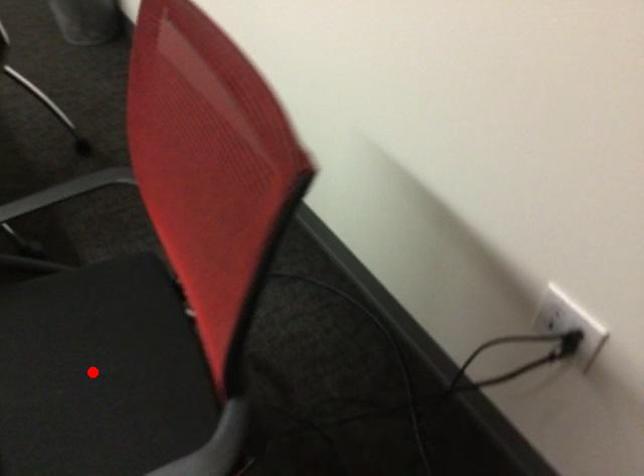
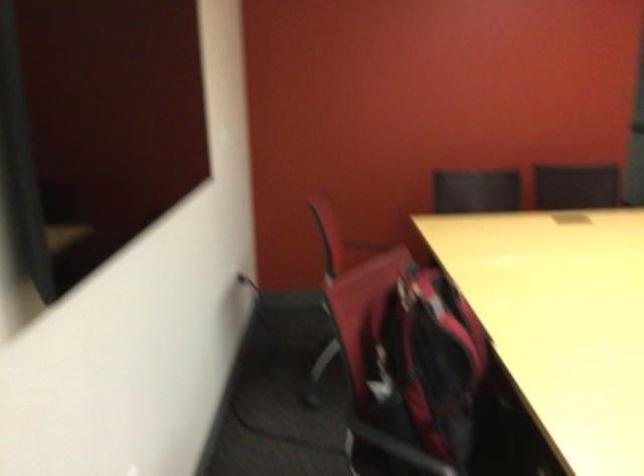
Question: I am providing you with two images of the same scene from different viewpoints. A red point is marked on the first image. Is the red point's position out of view in image 2?

Choices:
 (A) Yes
 (B) No

Answer: (A)